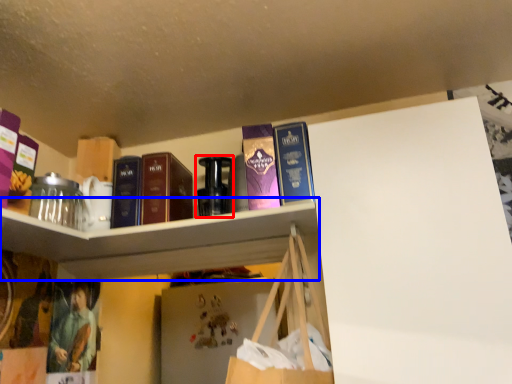
Question: Among these objects, which one is farthest to the camera, bottle (highlighted by a red box) or cabinet (highlighted by a blue box)?

Choices:
 (A) bottle
 (B) cabinet

Answer: (A)